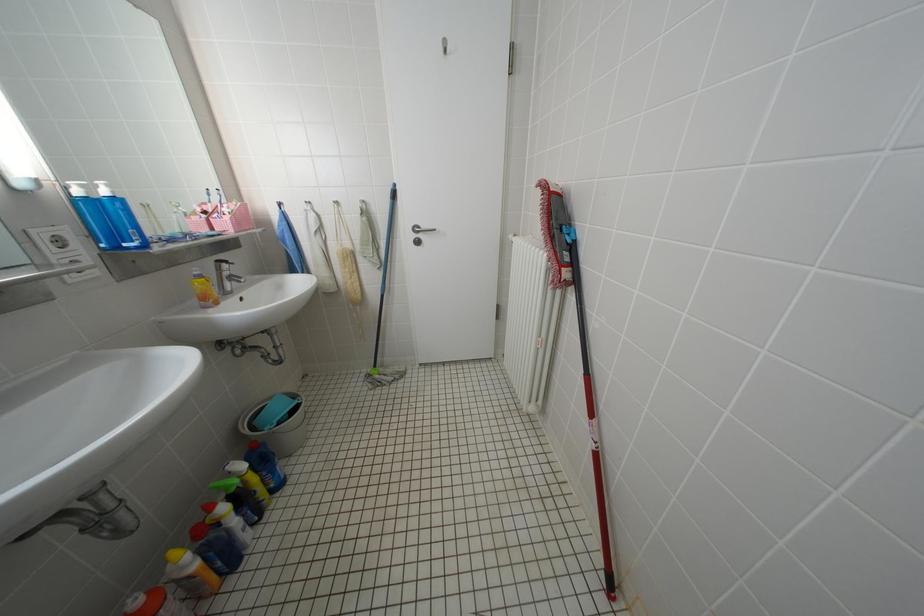
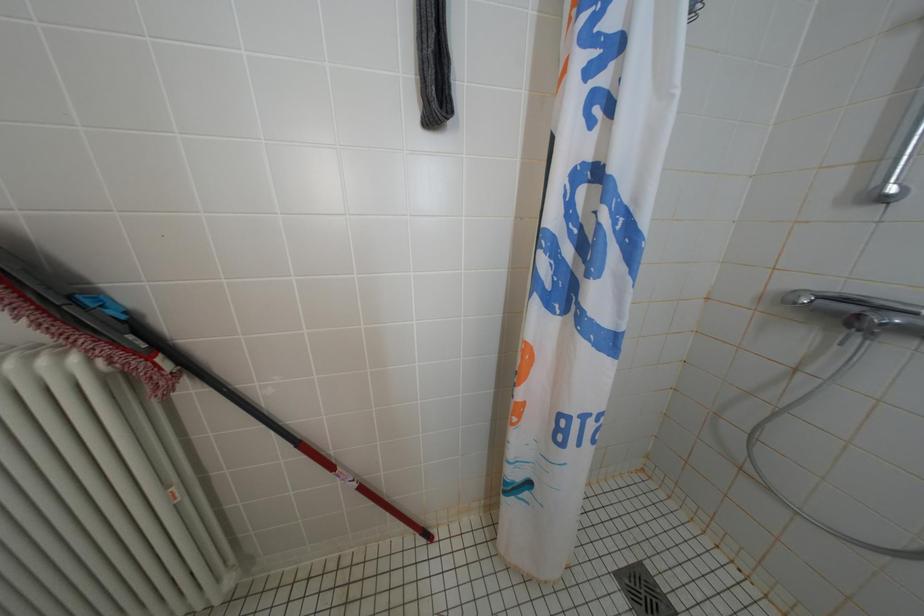
The first image is from the beginning of the video and the second image is from the end. How did the camera likely rotate when shooting the video?

The camera rotated toward right-down.